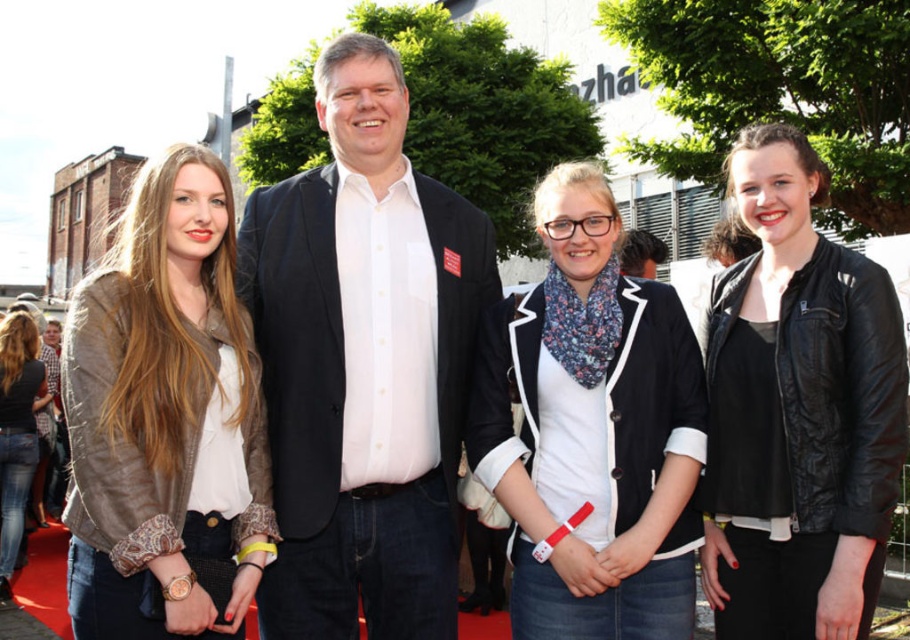
Question: Which object is positioned closest to the leather jacket at left?

Choices:
 (A) white cotton shirt at center
 (B) black leather jacket at center
 (C) black matte suit at center
 (D) denim jacket at lower left

Answer: (C)

Question: Which object appears closest to the camera in this image?

Choices:
 (A) leather jacket at left
 (B) white cotton shirt at center

Answer: (A)

Question: Does white cotton shirt at center have a larger size compared to denim jacket at lower left?

Choices:
 (A) yes
 (B) no

Answer: (A)

Question: Which of the following is the farthest from the observer?

Choices:
 (A) white cotton shirt at center
 (B) black matte suit at center
 (C) black leather jacket at center
 (D) leather jacket at left

Answer: (B)

Question: Does leather jacket at left lie behind black leather jacket at center?

Choices:
 (A) yes
 (B) no

Answer: (B)

Question: Is leather jacket at left in front of denim jacket at lower left?

Choices:
 (A) no
 (B) yes

Answer: (B)